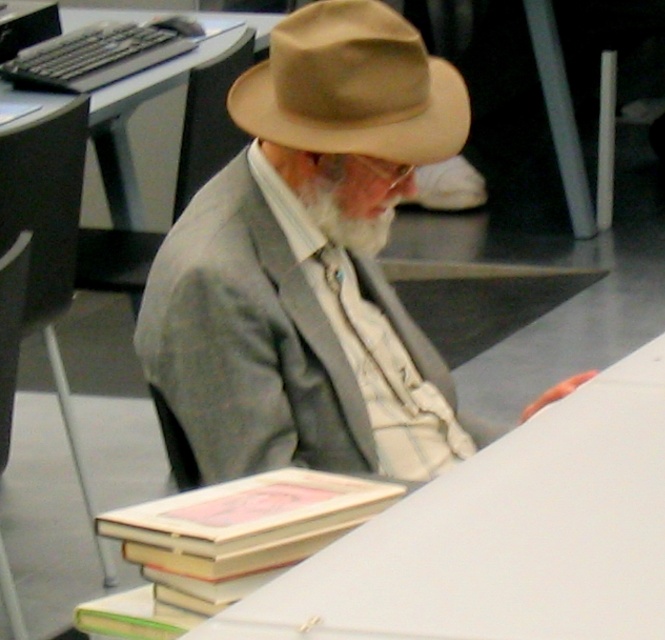
Describe the element at coordinates (352, 88) in the screenshot. I see `tan felt fedora at center` at that location.

This screenshot has height=640, width=665. Describe the element at coordinates (352, 88) in the screenshot. I see `tan felt fedora at center` at that location.

Locate an element on the screen. This screenshot has width=665, height=640. tan felt fedora at center is located at coordinates (352, 88).

Does hardcover book at lower center have a lesser height compared to tan felt fedora at center?

Yes.

What do you see at coordinates (223, 545) in the screenshot? Image resolution: width=665 pixels, height=640 pixels. I see `hardcover book at lower center` at bounding box center [223, 545].

Image resolution: width=665 pixels, height=640 pixels. What are the coordinates of `hardcover book at lower center` in the screenshot? It's located at (223, 545).

Can you confirm if light brown felt hat at center is shorter than hardcover book at lower center?

Incorrect, light brown felt hat at center's height does not fall short of hardcover book at lower center's.

Which is below, light brown felt hat at center or hardcover book at lower center?

Positioned lower is hardcover book at lower center.

Who is more forward, (249, 460) or (158, 572)?

Point (158, 572) is in front.

At what (x,y) coordinates should I click in order to perform the action: click on light brown felt hat at center. Please return your answer as a coordinate pair (x, y). The image size is (665, 640). Looking at the image, I should click on (307, 268).